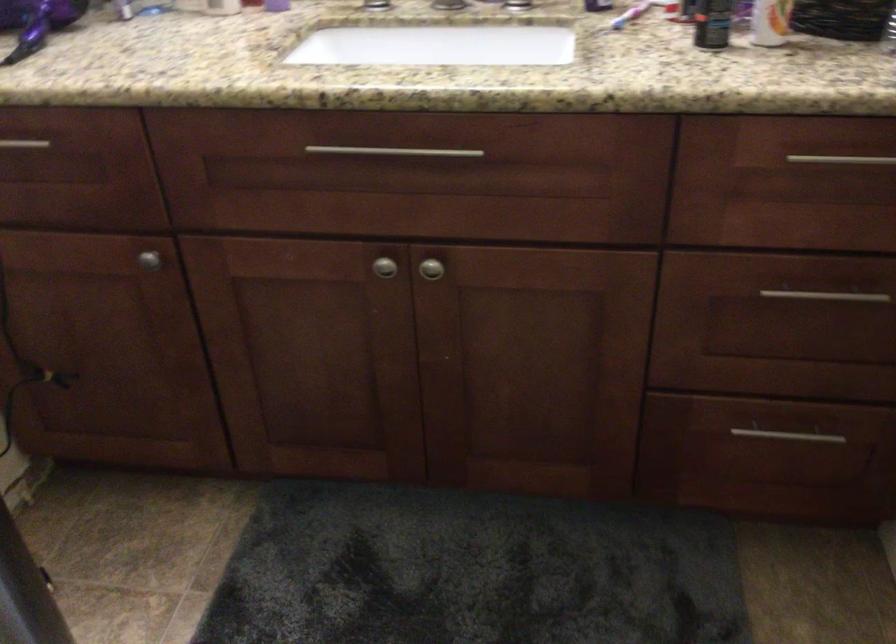
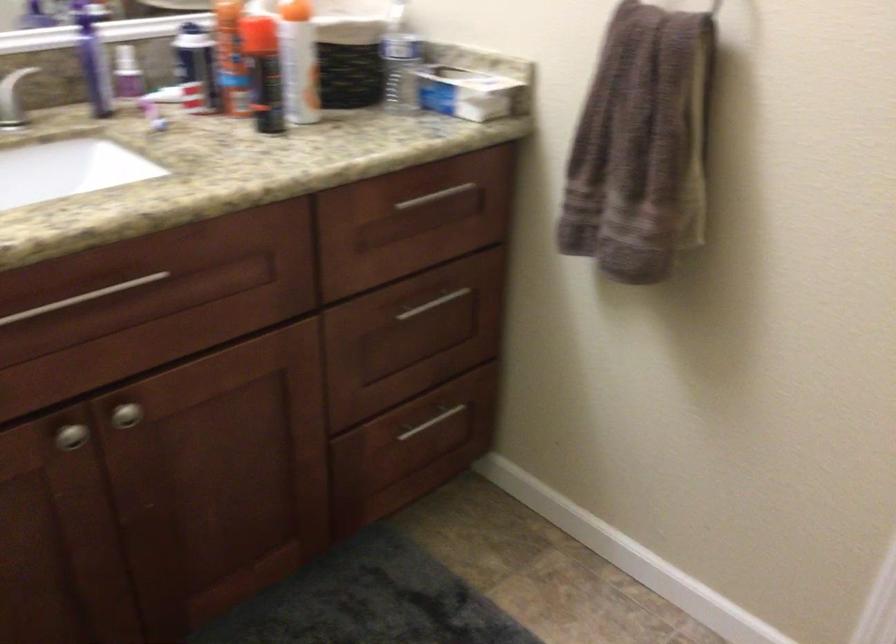
The point at (426,269) is marked in the first image. Where is the corresponding point in the second image?

(125, 415)